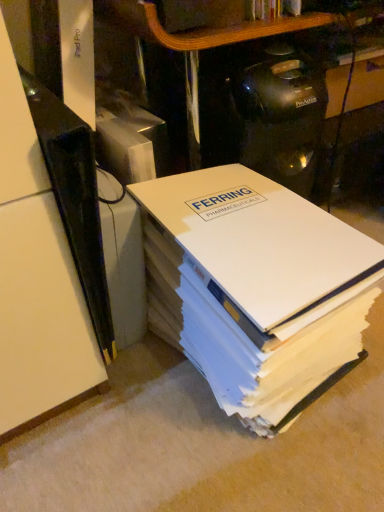
Describe the element at coordinates (36, 274) in the screenshot. The image size is (384, 512). I see `black plastic shelf at left` at that location.

Locate an element on the screen. The height and width of the screenshot is (512, 384). black plastic shelf at left is located at coordinates (36, 274).

Measure the distance between black plastic shelf at left and camera.

black plastic shelf at left and camera are 13.54 inches apart from each other.

The width and height of the screenshot is (384, 512). What do you see at coordinates (256, 288) in the screenshot?
I see `white paper at center` at bounding box center [256, 288].

The width and height of the screenshot is (384, 512). Find the location of `white paper at center`. white paper at center is located at coordinates (256, 288).

Locate an element on the screen. black plastic shelf at left is located at coordinates (36, 274).

Considering the positions of objects white paper at center and black plastic shelf at left in the image provided, who is more to the right, white paper at center or black plastic shelf at left?

white paper at center.

Consider the image. Is white paper at center in front of black plastic shelf at left?

Yes.

Is point (224, 316) in front of point (41, 212)?

No, (224, 316) is behind (41, 212).

From the image's perspective, which is above, white paper at center or black plastic shelf at left?

black plastic shelf at left.

In the scene shown: From a real-world perspective, between white paper at center and black plastic shelf at left, who is vertically higher?

black plastic shelf at left, from a real-world perspective.

Considering the sizes of white paper at center and black plastic shelf at left in the image, is white paper at center wider or thinner than black plastic shelf at left?

In the image, white paper at center appears to be more narrow than black plastic shelf at left.

Who is shorter, white paper at center or black plastic shelf at left?

white paper at center is shorter.

Does white paper at center have a smaller size compared to black plastic shelf at left?

No, white paper at center is not smaller than black plastic shelf at left.

Choose the correct answer: Is white paper at center inside black plastic shelf at left or outside it?

white paper at center is located beyond the bounds of black plastic shelf at left.

Is white paper at center far away from black plastic shelf at left?

No, white paper at center is in close proximity to black plastic shelf at left.

Could you tell me if white paper at center is turned towards black plastic shelf at left?

No, white paper at center is not aimed at black plastic shelf at left.

Measure the distance between white paper at center and black plastic shelf at left.

white paper at center and black plastic shelf at left are 22.53 centimeters apart from each other.

Where is `shelf behind the white paper at center`? shelf behind the white paper at center is located at coordinates (36, 274).

Between black plastic shelf at left and white paper at center, which one appears on the left side from the viewer's perspective?

black plastic shelf at left is more to the left.

Is black plastic shelf at left positioned before white paper at center?

That is False.

Considering the points (71, 318) and (318, 328), which point is in front, point (71, 318) or point (318, 328)?

Point (71, 318)

From the image's perspective, is black plastic shelf at left above or below white paper at center?

black plastic shelf at left is situated higher than white paper at center in the image.

From a real-world perspective, is black plastic shelf at left on white paper at center?

Indeed, from a real-world perspective, black plastic shelf at left stands above white paper at center.

Does black plastic shelf at left have a lesser width compared to white paper at center?

No, black plastic shelf at left is not thinner than white paper at center.

Can you confirm if black plastic shelf at left is shorter than white paper at center?

Incorrect, the height of black plastic shelf at left does not fall short of that of white paper at center.

Based on their sizes in the image, would you say black plastic shelf at left is bigger or smaller than white paper at center?

Clearly, black plastic shelf at left is smaller in size than white paper at center.

Which is correct: black plastic shelf at left is inside white paper at center, or outside of it?

black plastic shelf at left cannot be found inside white paper at center.

Are black plastic shelf at left and white paper at center far apart?

They are positioned close to each other.

Is black plastic shelf at left turned away from white paper at center?

black plastic shelf at left does not have its back to white paper at center.

In order to click on shelf that appears on the left of white paper at center in this screenshot , I will do `click(36, 274)`.

Locate an element on the screen. The image size is (384, 512). shelf above the white paper at center (from the image's perspective) is located at coordinates (36, 274).

I want to click on shelf above the white paper at center (from a real-world perspective), so click(x=36, y=274).